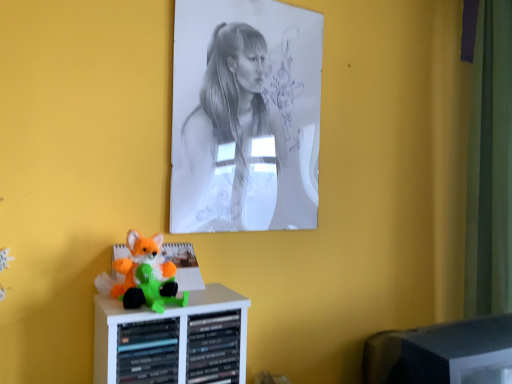
Question: Is fluffy plush toy at lower left oriented away from black plastic monitor at lower right?

Choices:
 (A) yes
 (B) no

Answer: (B)

Question: Can you confirm if fluffy plush toy at lower left is bigger than black plastic monitor at lower right?

Choices:
 (A) yes
 (B) no

Answer: (B)

Question: Does fluffy plush toy at lower left have a greater height compared to black plastic monitor at lower right?

Choices:
 (A) yes
 (B) no

Answer: (B)

Question: From a real-world perspective, is fluffy plush toy at lower left located beneath black plastic monitor at lower right?

Choices:
 (A) yes
 (B) no

Answer: (B)

Question: Is fluffy plush toy at lower left in front of black plastic monitor at lower right?

Choices:
 (A) yes
 (B) no

Answer: (A)

Question: Does point (145, 288) appear closer or farther from the camera than point (385, 332)?

Choices:
 (A) closer
 (B) farther

Answer: (A)

Question: Is fluffy plush toy at lower left bigger or smaller than black plastic monitor at lower right?

Choices:
 (A) big
 (B) small

Answer: (B)

Question: From their relative heights in the image, would you say fluffy plush toy at lower left is taller or shorter than black plastic monitor at lower right?

Choices:
 (A) tall
 (B) short

Answer: (B)

Question: From a real-world perspective, is fluffy plush toy at lower left positioned above or below black plastic monitor at lower right?

Choices:
 (A) above
 (B) below

Answer: (A)

Question: In terms of height, does black plastic monitor at lower right look taller or shorter compared to graphite paper portrait at upper center?

Choices:
 (A) short
 (B) tall

Answer: (A)

Question: Considering the relative positions of black plastic monitor at lower right and graphite paper portrait at upper center in the image provided, is black plastic monitor at lower right to the left or to the right of graphite paper portrait at upper center?

Choices:
 (A) left
 (B) right

Answer: (B)

Question: Is point (429, 382) positioned closer to the camera than point (224, 62)?

Choices:
 (A) closer
 (B) farther

Answer: (A)

Question: Is black plastic monitor at lower right bigger or smaller than graphite paper portrait at upper center?

Choices:
 (A) big
 (B) small

Answer: (A)

Question: From the image's perspective, is black plastic monitor at lower right above or below fluffy plush toy at lower left?

Choices:
 (A) below
 (B) above

Answer: (A)

Question: Visually, is black plastic monitor at lower right positioned to the left or to the right of fluffy plush toy at lower left?

Choices:
 (A) left
 (B) right

Answer: (B)